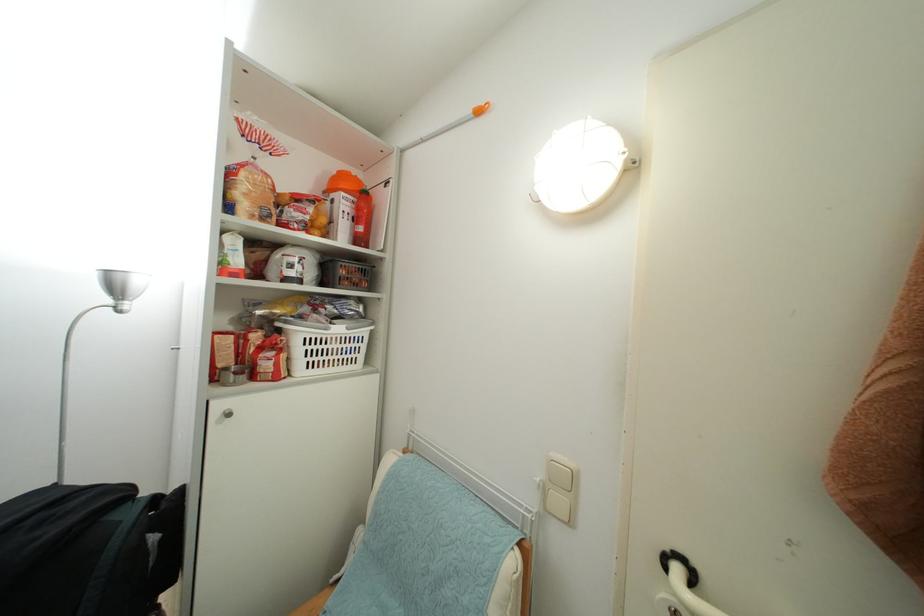
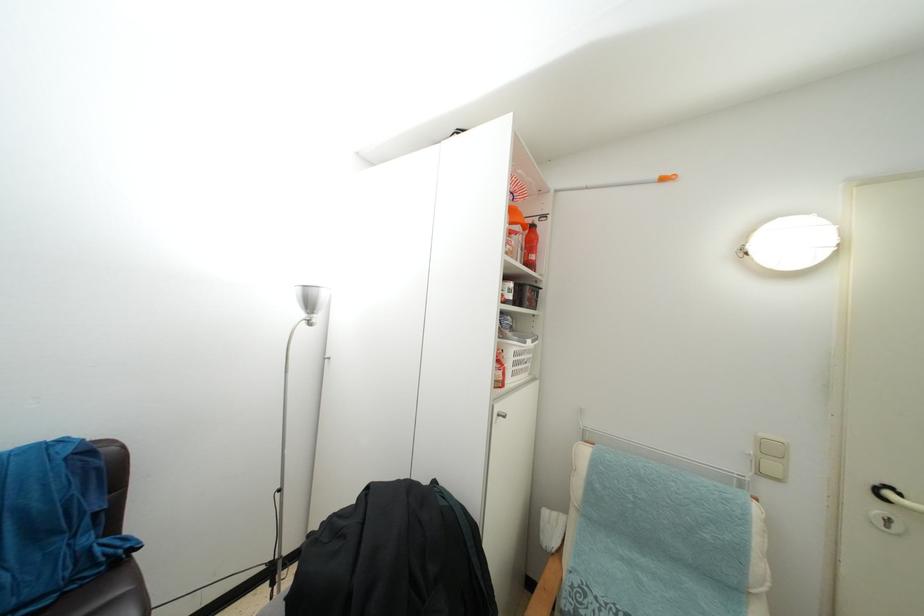
Find the pixel in the second image that matches (488,108) in the first image.

(674, 180)